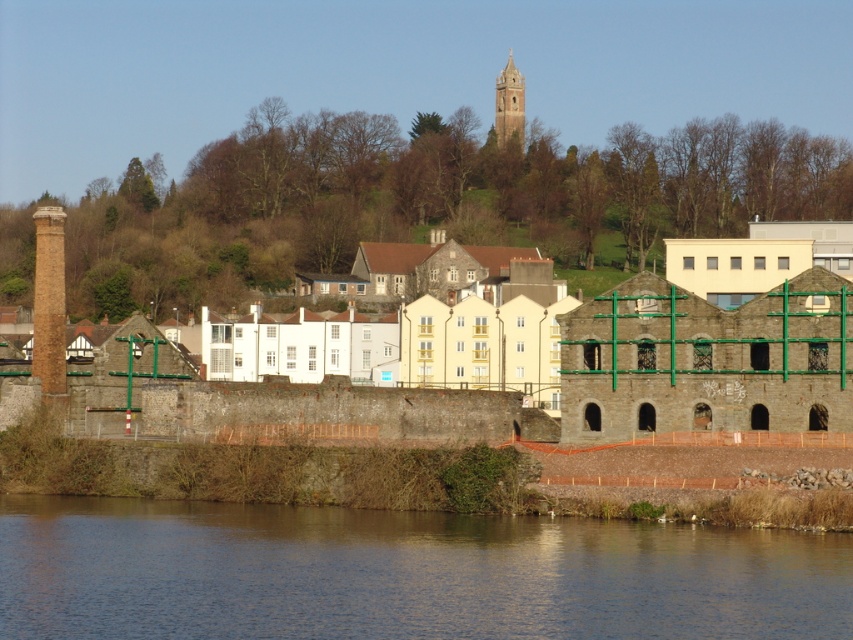
This screenshot has width=853, height=640. What are the coordinates of `brown water at lower left` in the screenshot? It's located at (402, 573).

Is point (418, 580) behind point (523, 97)?

No, it is not.

Find the location of a particular element. The image size is (853, 640). brown water at lower left is located at coordinates (402, 573).

Which is below, rustic stone building at center or brown stone tower at upper center?

rustic stone building at center

Measure the distance between point (317,355) and camera.

Point (317,355) and camera are 155.23 meters apart.

Identify the location of rustic stone building at center. The height and width of the screenshot is (640, 853). (650, 355).

At what (x,y) coordinates should I click in order to perform the action: click on rustic stone building at center. Please return your answer as a coordinate pair (x, y). The image size is (853, 640). Looking at the image, I should click on (650, 355).

Is brown water at lower left behind rustic stone building at center?

No, it is in front of rustic stone building at center.

Who is positioned more to the right, brown water at lower left or rustic stone building at center?

From the viewer's perspective, rustic stone building at center appears more on the right side.

I want to click on brown water at lower left, so click(402, 573).